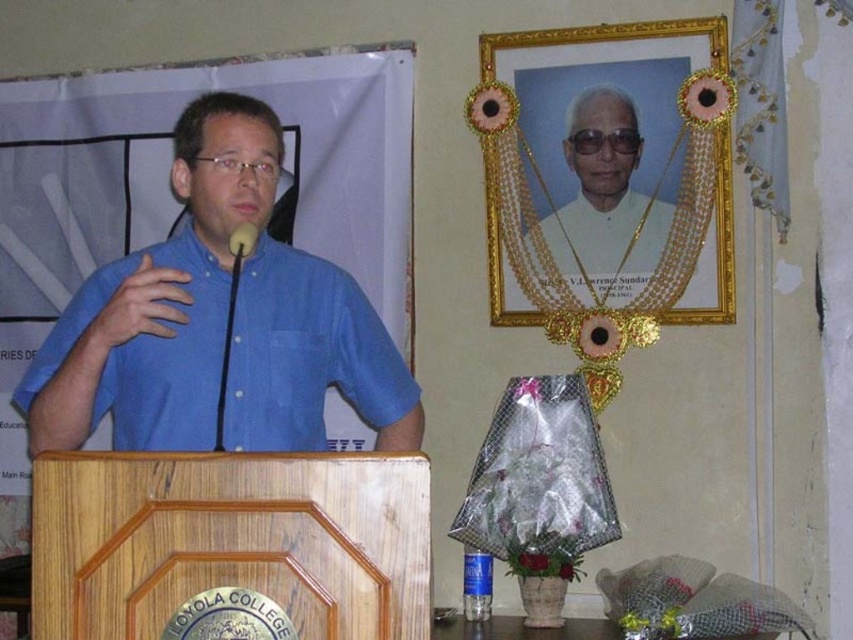
Looking at this image, between matte blue shirt at left and gold/golden picture frame at upper center, which one has more height?

Standing taller between the two is gold/golden picture frame at upper center.

Which is in front, point (218, 204) or point (527, 108)?

Point (218, 204) is in front.

Where is `matte blue shirt at left`? This screenshot has width=853, height=640. matte blue shirt at left is located at coordinates click(160, 300).

Identify the location of matte blue shirt at left. 160,300.

Is white clothed man at upper right taller than matte black microphone at center?

Yes.

Is white clothed man at upper right further to the viewer compared to matte black microphone at center?

Yes, white clothed man at upper right is behind matte black microphone at center.

Is point (625, 208) more distant than point (251, 232)?

Yes, point (625, 208) is behind point (251, 232).

Find the location of a particular element. Image resolution: width=853 pixels, height=640 pixels. white clothed man at upper right is located at coordinates (605, 189).

Is gold/golden picture frame at upper center below matte black microphone at center?

No.

Is point (538, 84) behind point (242, 234)?

Yes, it is behind point (242, 234).

The width and height of the screenshot is (853, 640). I want to click on gold/golden picture frame at upper center, so click(x=599, y=122).

This screenshot has height=640, width=853. I want to click on gold/golden picture frame at upper center, so click(599, 122).